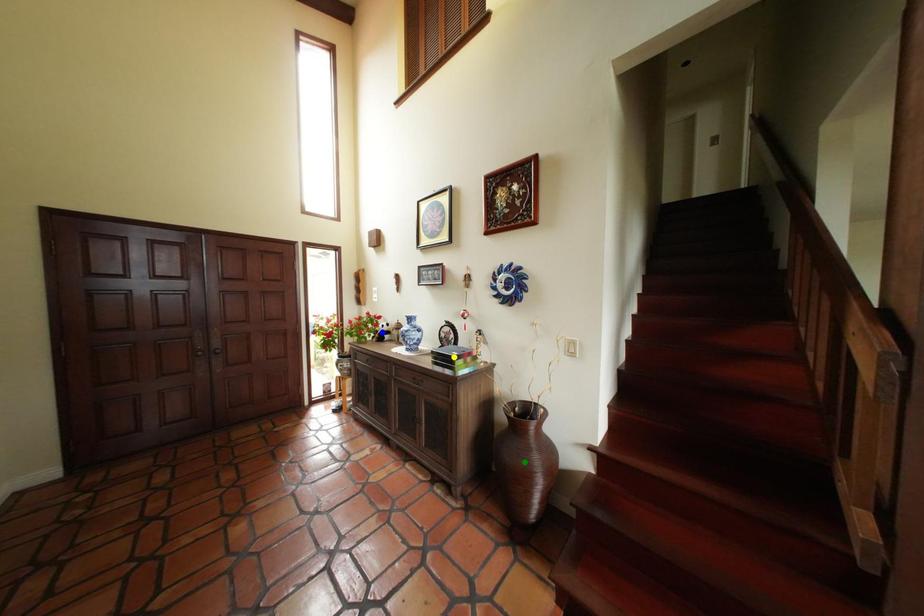
Order these from farthest to nearest:
A) blue point
B) green point
C) yellow point

1. blue point
2. yellow point
3. green point